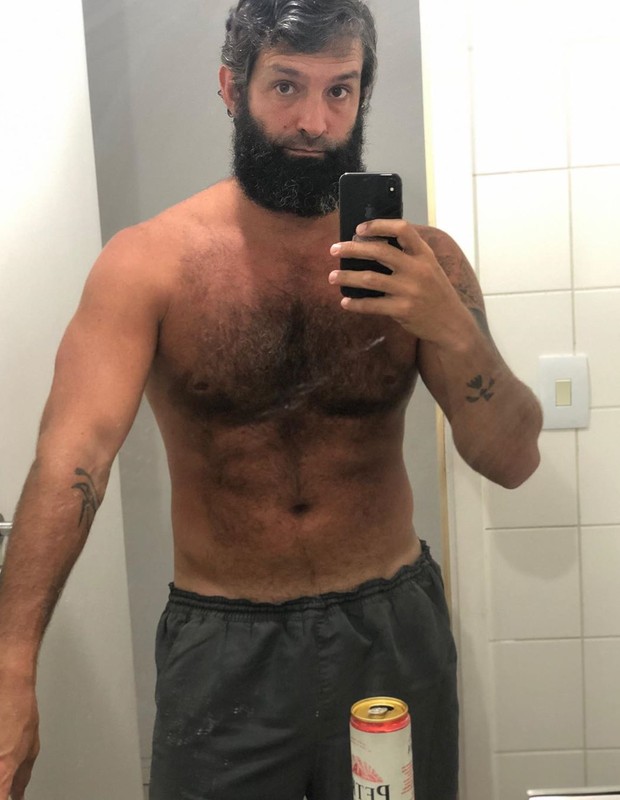
In order to click on white background wall in this screenshot , I will do `click(124, 25)`, `click(192, 33)`, `click(130, 194)`, `click(201, 160)`, `click(399, 130)`, `click(407, 25)`, `click(138, 498)`, `click(144, 610)`, `click(418, 457)`.